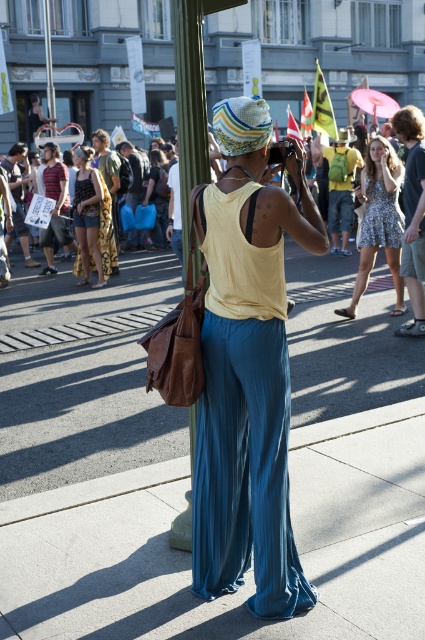
You are a tailor who needs to adjust the proportions of the blue fabric pants at center and the matte yellow tank top at center to ensure they look balanced in the image. Which clothing item should you make narrower to achieve this balance?

The blue fabric pants at center are wider than the matte yellow tank top at center. To balance them, you should narrow the blue fabric pants at center.

You are a photographer trying to capture a candid shot of the person in the blue fabric pants at center and the blue pleated pants at center. Your camera has a maximum focus range of 1.5 meters. Can you capture both subjects in focus without moving your position?

The blue fabric pants at center and blue pleated pants at center are 1.68 meters apart, which exceeds the camera maximum focus range of 1.5 meters. Therefore, you cannot capture both subjects in focus without moving your position.